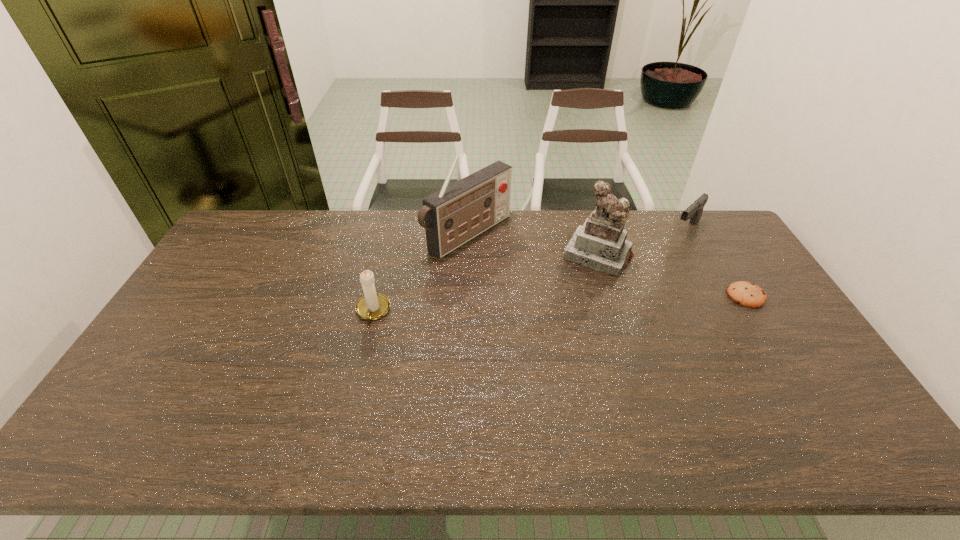
You are a GUI agent. You are given a task and a screenshot of the screen. Output one action in this format:
    pyautogui.click(x=<x>, y=<y>)
    Task: Click on the vacant space on the desktop that is between the third shortest object and the cookie and is positioned aim along the barrel of the pistol
    
    Given the screenshot: What is the action you would take?
    pyautogui.click(x=609, y=301)

Where is `free space on the desktop that is between the third shortest object and the cookie and is positioned on the front panel of the radio receiver`? The image size is (960, 540). free space on the desktop that is between the third shortest object and the cookie and is positioned on the front panel of the radio receiver is located at coordinates (579, 303).

This screenshot has height=540, width=960. I want to click on vacant space on the desktop that is between the leftmost object and the cookie and is positioned on the front-facing side of the third object from right to left, so click(x=570, y=303).